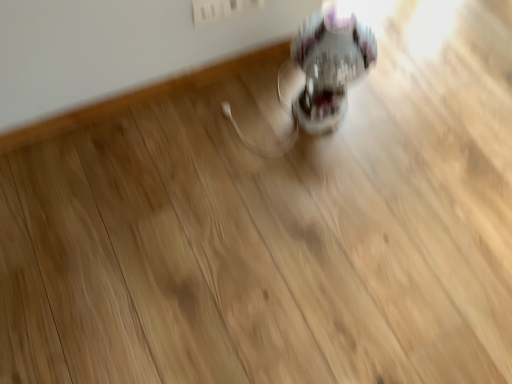
Locate an element on the screen. free area below translucent plastic swivel chair at center (from a real-world perspective) is located at coordinates (312, 124).